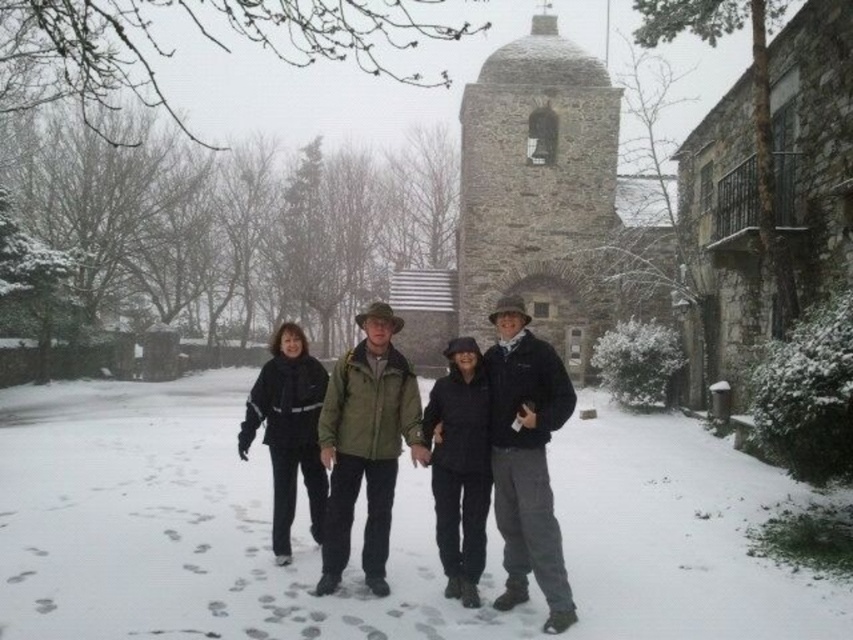
Which is behind, point (543, 276) or point (479, 385)?

The point (543, 276) is more distant.

Between point (581, 97) and point (468, 576), which one is positioned in front?

Point (468, 576) is more forward.

At what (x,y) coordinates should I click in order to perform the action: click on stone textured tower at center. Please return your answer as a coordinate pair (x, y). Image resolution: width=853 pixels, height=640 pixels. Looking at the image, I should click on (538, 188).

Which is in front, point (45, 600) or point (434, 474)?

Point (45, 600) is more forward.

Consider the image. Can you confirm if white powdery snow at center is smaller than black woolen coat at center?

Incorrect, white powdery snow at center is not smaller in size than black woolen coat at center.

Between point (839, 632) and point (438, 472), which one is positioned behind?

The point (438, 472) is behind.

Identify the location of white powdery snow at center. (361, 531).

Is white powdery snow at center above black matte jacket at center?

No, white powdery snow at center is not above black matte jacket at center.

Can you confirm if white powdery snow at center is shorter than black matte jacket at center?

Yes.

Identify the location of white powdery snow at center. The height and width of the screenshot is (640, 853). (361, 531).